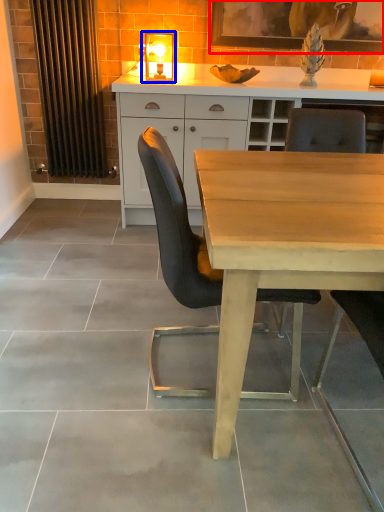
Question: Among these objects, which one is farthest to the camera, picture frame (highlighted by a red box) or light fixture (highlighted by a blue box)?

Choices:
 (A) picture frame
 (B) light fixture

Answer: (A)